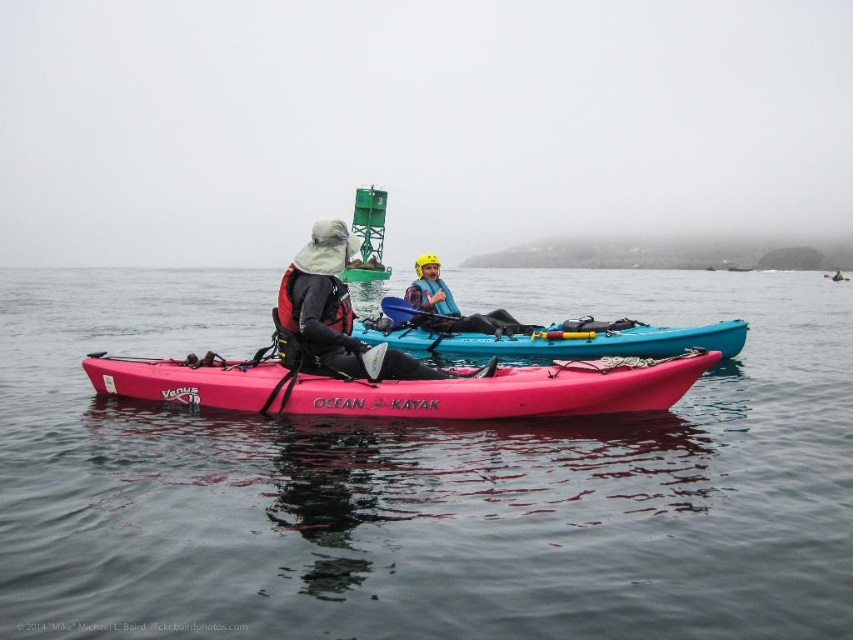
You are a photographer positioned on the shore and want to capture both the teal glossy kayak at center and the red matte life jacket at center in a single shot. Which object will appear closer to the camera in the photo?

The teal glossy kayak at center will appear closer to the camera because it is further to the viewer than the red matte life jacket at center.

You are a safety officer assessing the distance between the yellow helmet at center and the smooth dark water at center in the kayaking scene. According to safety regulations, the minimum safe distance between a kayak helmet and the water surface should be at least 10 meters. Is the current distance compliant with the regulations?

The smooth dark water at center and yellow helmet at center are 9.54 meters apart, which is less than the required 10 meters. Therefore, the current distance does not comply with the safety regulations.

You are a kayaker planning to navigate through the area shown in the image. There is a point at coordinates (422,477). What is located at this point?

At point (422,477) lies smooth dark water at center.